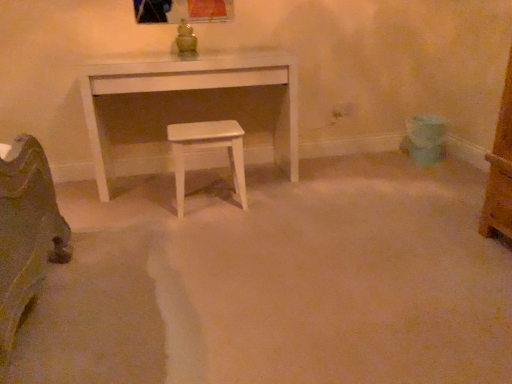
Question: Is white matte table at center facing away from white glossy stool at center?

Choices:
 (A) no
 (B) yes

Answer: (B)

Question: Can you confirm if white matte table at center is thinner than white glossy stool at center?

Choices:
 (A) yes
 (B) no

Answer: (B)

Question: Is white matte table at center next to white glossy stool at center?

Choices:
 (A) no
 (B) yes

Answer: (A)

Question: Can white glossy stool at center be found inside white matte table at center?

Choices:
 (A) no
 (B) yes

Answer: (A)

Question: Could you tell me if white matte table at center is facing white glossy stool at center?

Choices:
 (A) no
 (B) yes

Answer: (B)

Question: Is white matte table at center located outside white glossy stool at center?

Choices:
 (A) yes
 (B) no

Answer: (A)

Question: Is white glossy stool at center in front of white matte table at center?

Choices:
 (A) no
 (B) yes

Answer: (B)

Question: Are white glossy stool at center and white matte table at center beside each other?

Choices:
 (A) yes
 (B) no

Answer: (B)

Question: Does white glossy stool at center have a lesser height compared to white matte table at center?

Choices:
 (A) yes
 (B) no

Answer: (A)

Question: Considering the relative sizes of white glossy stool at center and white matte table at center in the image provided, is white glossy stool at center thinner than white matte table at center?

Choices:
 (A) no
 (B) yes

Answer: (B)

Question: Would you say white glossy stool at center is outside white matte table at center?

Choices:
 (A) yes
 (B) no

Answer: (A)

Question: Could you tell me if white glossy stool at center is turned towards white matte table at center?

Choices:
 (A) yes
 (B) no

Answer: (B)

Question: Is white glossy stool at center situated inside white matte table at center or outside?

Choices:
 (A) inside
 (B) outside

Answer: (B)